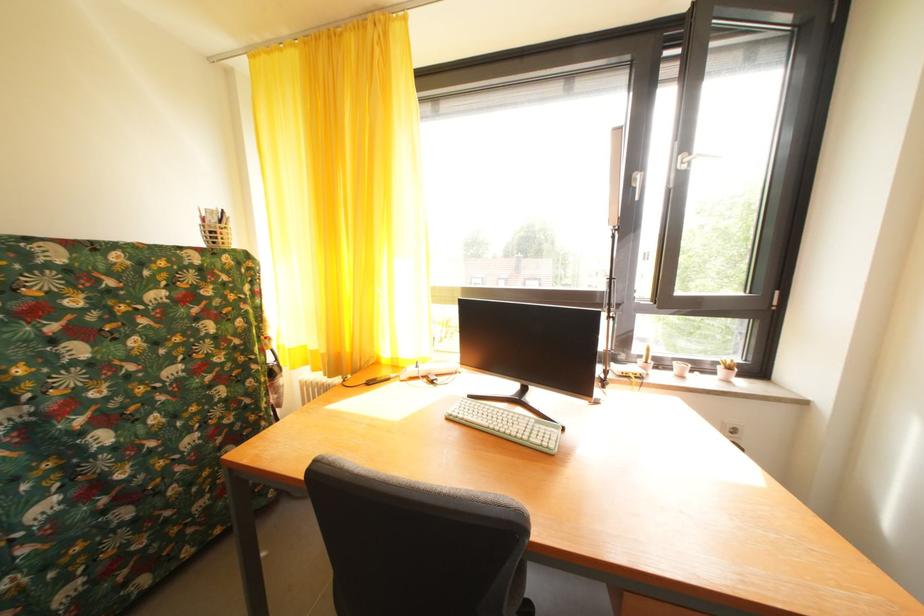
Find where to lift the wicker pen holder. Please return your answer as a coordinate pair (x, y).

(214, 228)